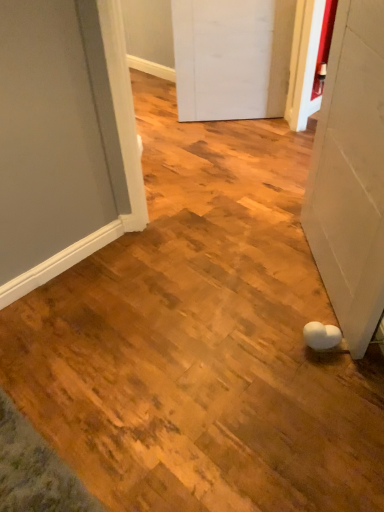
Locate an element on the screen. The width and height of the screenshot is (384, 512). vacant space that is to the left of white matte door at lower right, which is the second door from top to bottom is located at coordinates (242, 290).